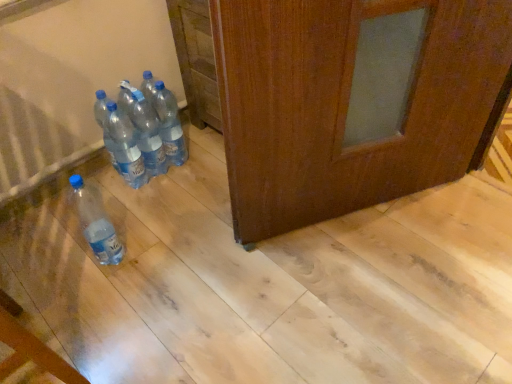
Image resolution: width=512 pixels, height=384 pixels. What are the coordinates of `free space that is to the left of matte plastic bottle at lower left, which appears as the fourth bottle when viewed from the right` in the screenshot? It's located at (54, 263).